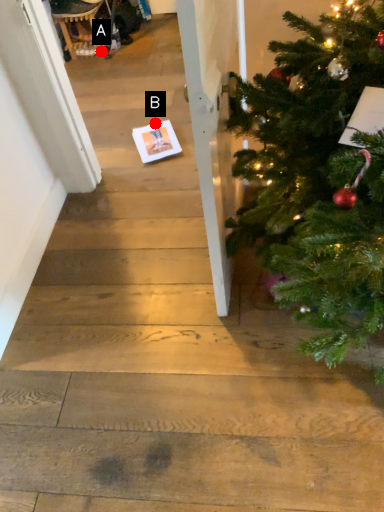
Question: Two points are circled on the image, labeled by A and B beside each circle. Which point is farther from the camera taking this photo?

Choices:
 (A) A is further
 (B) B is further

Answer: (A)